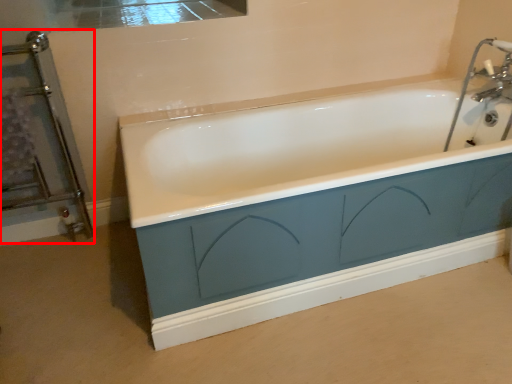
Question: From the image's perspective, where is screen door (annotated by the red box) located in relation to sink in the image?

Choices:
 (A) above
 (B) below

Answer: (B)